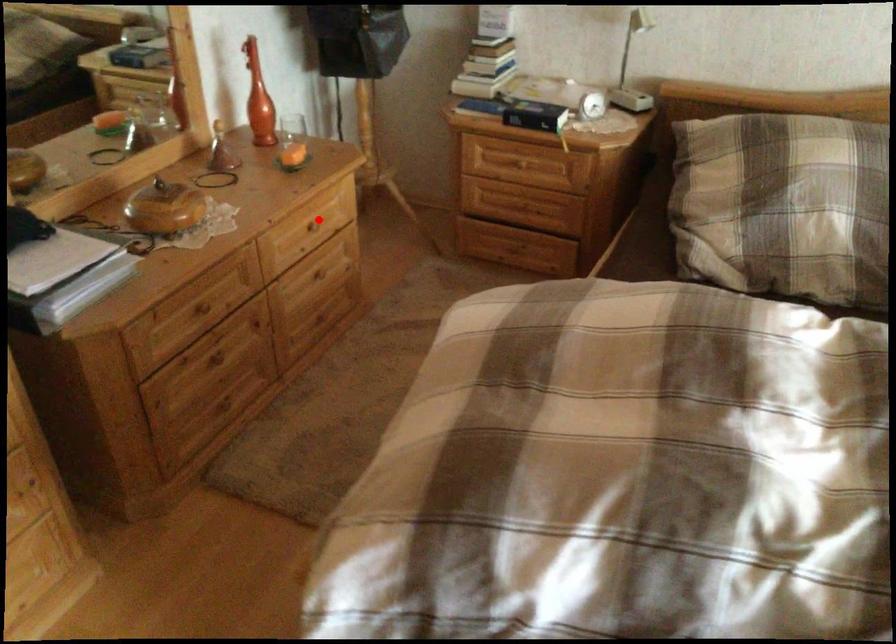
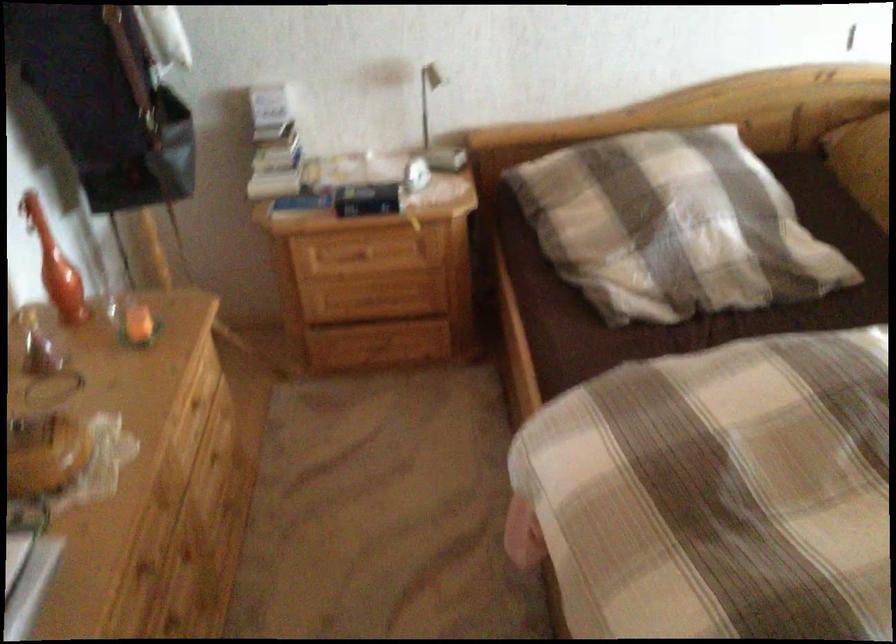
Question: I am providing you with two images of the same scene from different viewpoints. Image1 has a red point marked. In image2, the corresponding 3D location appears at what relative position? Reply with the corresponding letter.

Choices:
 (A) Closer
 (B) Farther

Answer: (A)